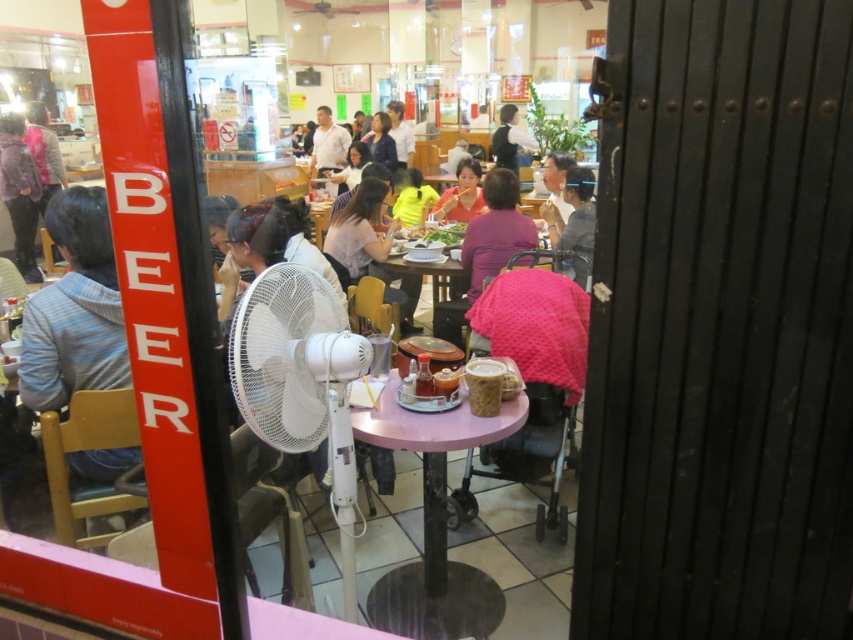
Between matte gray shirt at center and matte pink shirt at center, which one is positioned lower?

matte gray shirt at center

Does matte gray shirt at center have a larger size compared to matte pink shirt at center?

Indeed, matte gray shirt at center has a larger size compared to matte pink shirt at center.

Locate an element on the screen. Image resolution: width=853 pixels, height=640 pixels. matte gray shirt at center is located at coordinates (576, 221).

Consider the image. Does striped sweater at left have a larger size compared to matte pink shirt at center?

Incorrect, striped sweater at left is not larger than matte pink shirt at center.

Does point (21, 339) lie behind point (448, 220)?

No, it is in front of (448, 220).

This screenshot has width=853, height=640. What are the coordinates of `striped sweater at left` in the screenshot? It's located at (74, 308).

Can you confirm if striped sweater at left is positioned above matte black jacket at left?

Actually, striped sweater at left is below matte black jacket at left.

Does point (62, 356) come closer to viewer compared to point (28, 269)?

That is True.

The height and width of the screenshot is (640, 853). Describe the element at coordinates (74, 308) in the screenshot. I see `striped sweater at left` at that location.

The height and width of the screenshot is (640, 853). Find the location of `striped sweater at left`. striped sweater at left is located at coordinates (74, 308).